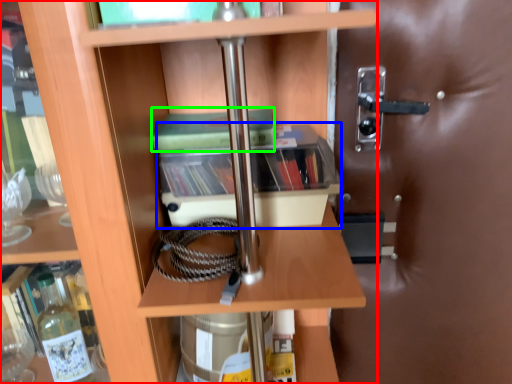
Question: Based on their relative distances, which object is farther from shelf (highlighted by a red box)? Choose from cabinetry (highlighted by a blue box) and paperback book (highlighted by a green box).

Choices:
 (A) cabinetry
 (B) paperback book

Answer: (B)